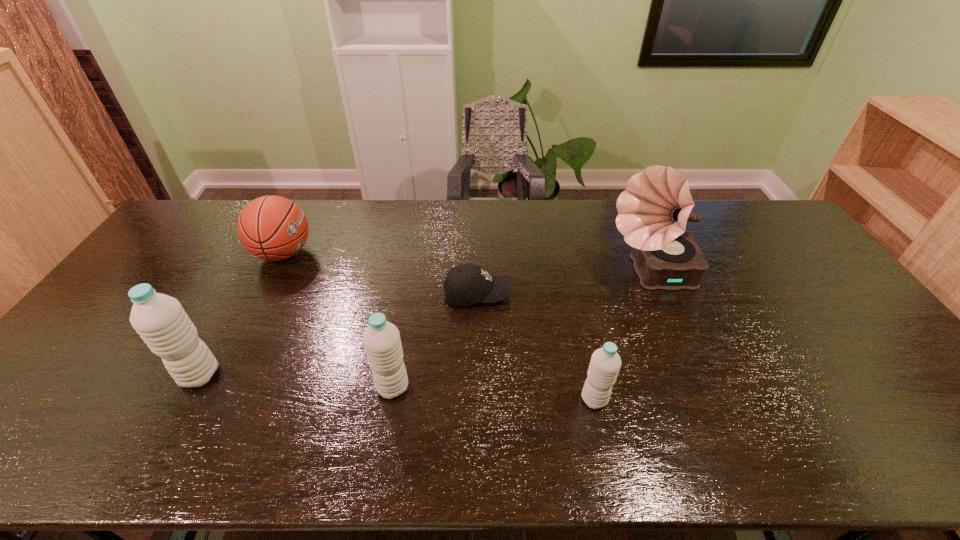
Where is `vacant space at the far edge`? The width and height of the screenshot is (960, 540). vacant space at the far edge is located at coordinates (441, 217).

This screenshot has height=540, width=960. I want to click on free space at the near edge of the desktop, so click(x=535, y=395).

The height and width of the screenshot is (540, 960). I want to click on free space at the left edge of the desktop, so click(188, 247).

In order to click on vacant space at the right edge in this screenshot , I will do `click(803, 250)`.

Image resolution: width=960 pixels, height=540 pixels. In the image, there is a desktop. Find the location of `vacant space at the far left corner`. vacant space at the far left corner is located at coordinates (202, 225).

This screenshot has height=540, width=960. In order to click on free space at the near right corner in this screenshot , I will do `click(932, 407)`.

Where is `empty location between the shortest object and the rightmost water bottle`? empty location between the shortest object and the rightmost water bottle is located at coordinates (536, 347).

I want to click on vacant region between the fourth shortest object and the third object from right to left, so click(435, 340).

The image size is (960, 540). Identify the location of free space between the record player and the tallest water bottle. (424, 325).

Where is `vacant area that lies between the basketball and the rightmost water bottle`? The image size is (960, 540). vacant area that lies between the basketball and the rightmost water bottle is located at coordinates 439,326.